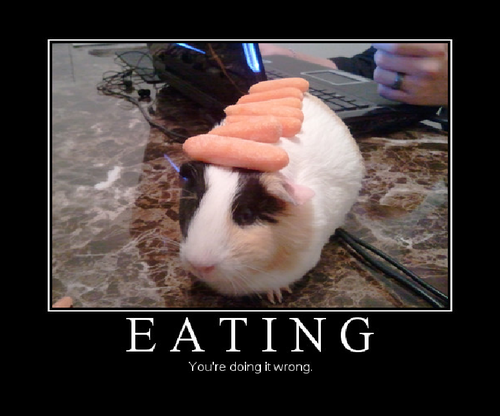
Find the location of a particular element. The height and width of the screenshot is (416, 500). mouse pad is located at coordinates (133, 59).